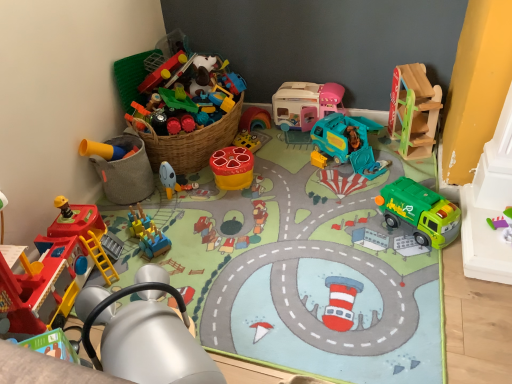
The width and height of the screenshot is (512, 384). Find the location of `free spot to the left of blue plastic train at center, acting as the 8th toy starting from the right`. free spot to the left of blue plastic train at center, acting as the 8th toy starting from the right is located at coordinates (121, 229).